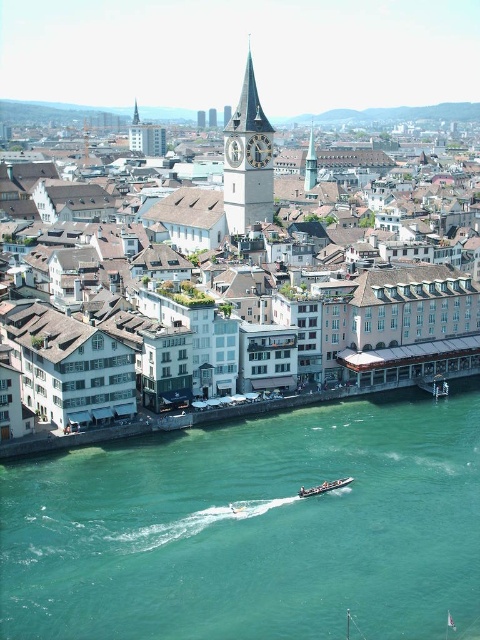
Identify the location of white textured building at center. (399, 115).

From the picture: Can you confirm if white textured building at center is positioned above metallic silver boat at lower center?

Yes, white textured building at center is above metallic silver boat at lower center.

Who is more forward, (404,337) or (330,484)?

Point (330,484)

Find the location of `white textured building at center`. white textured building at center is located at coordinates (399, 115).

Which is behind, point (231, 172) or point (312, 179)?

The point (312, 179) is behind.

Can you confirm if white stone clock tower at center is smaller than smooth stone clock tower at center?

Incorrect, white stone clock tower at center is not smaller in size than smooth stone clock tower at center.

Does point (235, 188) come farther from viewer compared to point (311, 154)?

No, (235, 188) is in front of (311, 154).

Locate an element on the screen. The width and height of the screenshot is (480, 640). white stone clock tower at center is located at coordinates (248, 161).

Between teal glossy water at lower center and smooth stone clock tower at center, which one appears on the right side from the viewer's perspective?

smooth stone clock tower at center is more to the right.

Measure the distance between teal glossy water at lower center and smooth stone clock tower at center.

A distance of 208.03 meters exists between teal glossy water at lower center and smooth stone clock tower at center.

The width and height of the screenshot is (480, 640). I want to click on teal glossy water at lower center, so point(252,529).